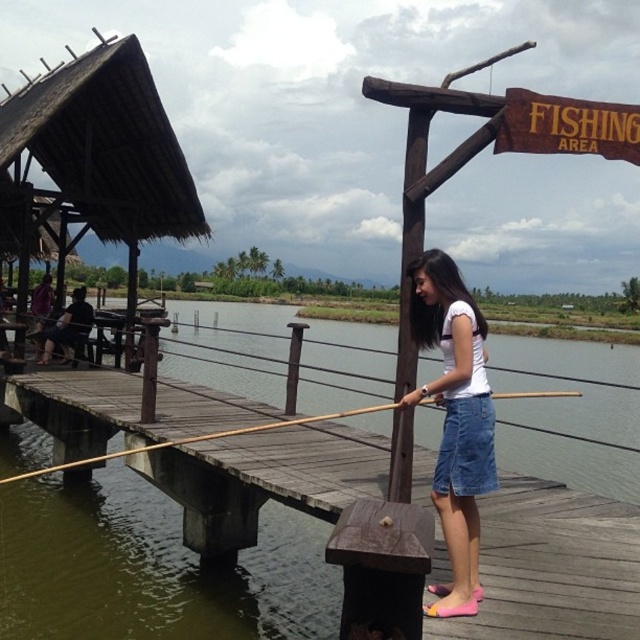
Question: Can you confirm if denim skirt at center is positioned above brown wooden fishing pole at center?

Choices:
 (A) yes
 (B) no

Answer: (A)

Question: Which point is farther to the camera?

Choices:
 (A) denim skirt at center
 (B) brown wooden fishing pole at center

Answer: (B)

Question: Does denim skirt at center come behind brown wooden fishing pole at center?

Choices:
 (A) yes
 (B) no

Answer: (B)

Question: Can you confirm if denim skirt at center is bigger than brown wooden fishing pole at center?

Choices:
 (A) yes
 (B) no

Answer: (B)

Question: Which of the following is the closest to the observer?

Choices:
 (A) brown wooden fishing pole at center
 (B) denim skirt at center

Answer: (B)